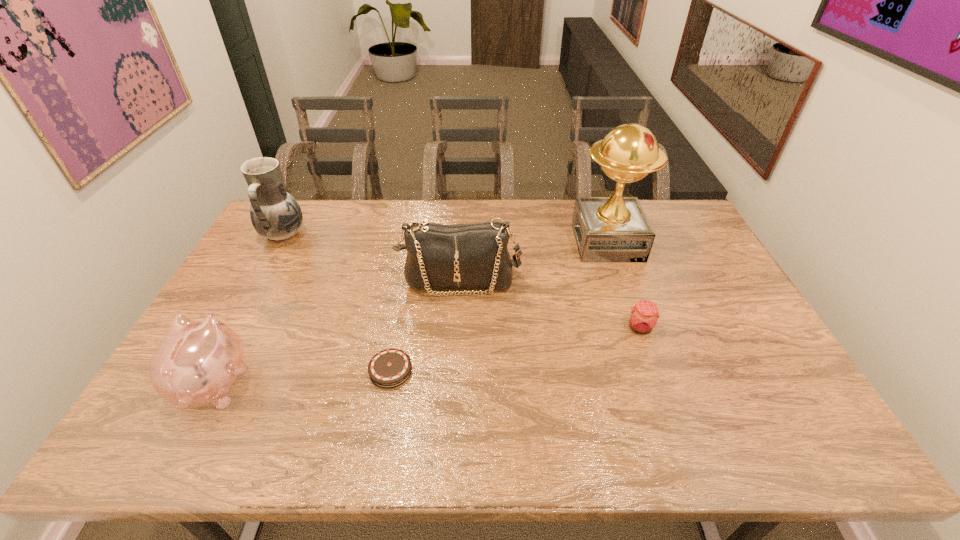
Where is `vacant area situated on the front-facing side of the award`? vacant area situated on the front-facing side of the award is located at coordinates (507, 242).

Find the location of a particular element. The width and height of the screenshot is (960, 540). vacant area located 0.310m on the front-facing side of the pitcher is located at coordinates (395, 235).

The image size is (960, 540). Identify the location of vacant region located at the front of the handbag with chain and zipper. (456, 345).

Where is `free spot located on the front facing side of the third shortest object`? free spot located on the front facing side of the third shortest object is located at coordinates (260, 296).

Find the location of a particular element. Image resolution: width=960 pixels, height=540 pixels. free region located on the front facing side of the third shortest object is located at coordinates (262, 294).

I want to click on vacant region located 0.130m on the front facing side of the third shortest object, so click(252, 313).

This screenshot has width=960, height=540. What are the coordinates of `vacant position located 0.330m on the front of the second shortest object` in the screenshot? It's located at (685, 456).

I want to click on free spot located 0.210m on the back of the shortest object, so 405,292.

Where is `award that is positioned at the far edge`? award that is positioned at the far edge is located at coordinates (607, 229).

In order to click on pitcher located at the far edge in this screenshot , I will do `click(275, 214)`.